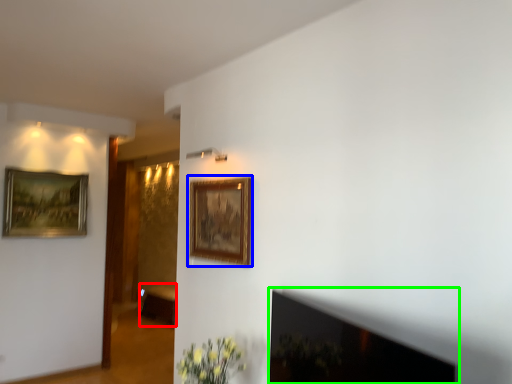
Question: Which is nearer to the furniture (highlighted by a red box)? picture frame (highlighted by a blue box) or fireplace (highlighted by a green box).

Choices:
 (A) picture frame
 (B) fireplace

Answer: (A)